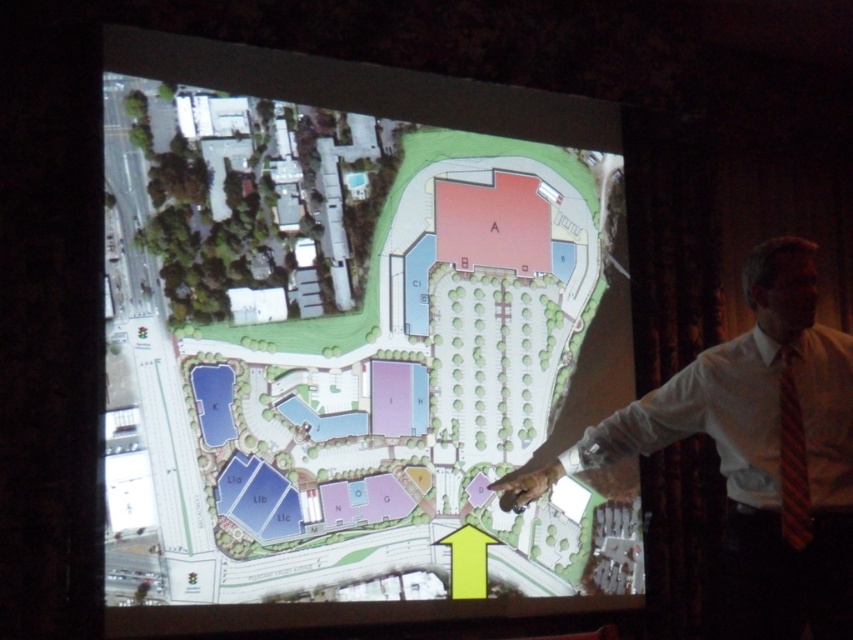
Who is more forward, (839, 406) or (843, 483)?

Point (843, 483)

Which is in front, point (761, 326) or point (845, 369)?

Positioned in front is point (845, 369).

Identify the location of white shirt at upper right. Image resolution: width=853 pixels, height=640 pixels. (757, 451).

Does green grass at bottom appear on the left side of white satin dress shirt at center?

Correct, you'll find green grass at bottom to the left of white satin dress shirt at center.

Which is below, green grass at bottom or white satin dress shirt at center?

white satin dress shirt at center is lower down.

Who is more distant from viewer, (355, 451) or (733, 458)?

The point (355, 451) is behind.

I want to click on green grass at bottom, so click(352, 355).

Does point (511, 232) lie behind point (784, 604)?

Yes, it is behind point (784, 604).

Is green grass at bottom shorter than white shirt at upper right?

No.

Locate an element on the screen. Image resolution: width=853 pixels, height=640 pixels. green grass at bottom is located at coordinates (352, 355).

Where is `green grass at bottom`? green grass at bottom is located at coordinates (352, 355).